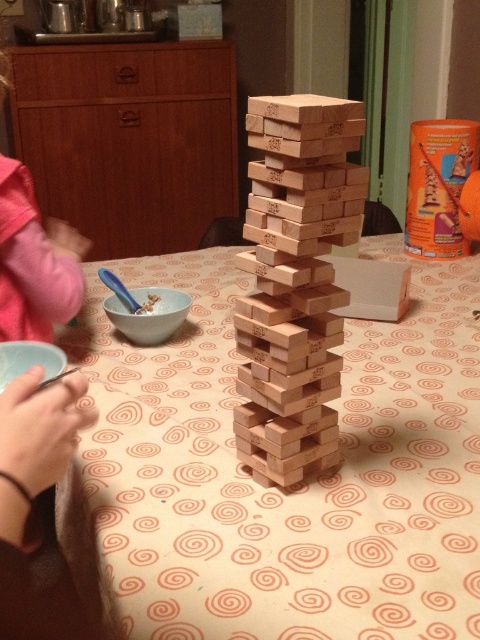
Question: Which of the following is the closest to the observer?

Choices:
 (A) (33, 316)
 (B) (432, 592)
 (C) (269, 209)

Answer: (B)

Question: Does wooden table at center appear on the left side of pink fabric sleeve at left?

Choices:
 (A) yes
 (B) no

Answer: (B)

Question: Is natural wood tower at center wider than pink fabric sleeve at left?

Choices:
 (A) no
 (B) yes

Answer: (A)

Question: Among these objects, which one is farthest from the camera?

Choices:
 (A) natural wood tower at center
 (B) pink fabric sleeve at left
 (C) wooden table at center

Answer: (B)

Question: Where is wooden table at center located in relation to natural wood tower at center in the image?

Choices:
 (A) right
 (B) left

Answer: (A)

Question: Which point appears farthest from the camera in this image?

Choices:
 (A) (4, 262)
 (B) (414, 349)
 (C) (282, 368)

Answer: (B)